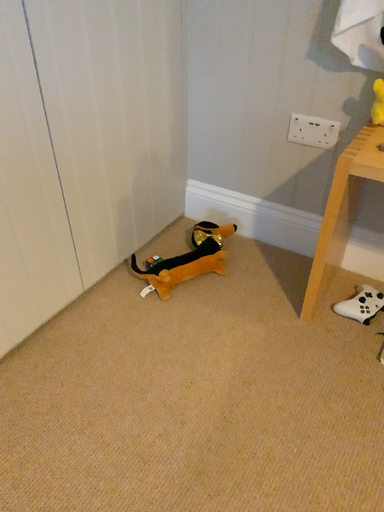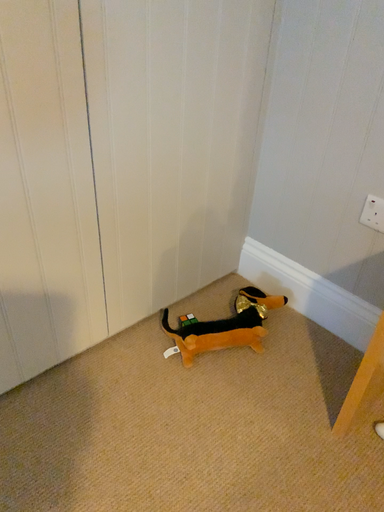
Question: How did the camera likely rotate when shooting the video?

Choices:
 (A) rotated right
 (B) rotated left

Answer: (B)